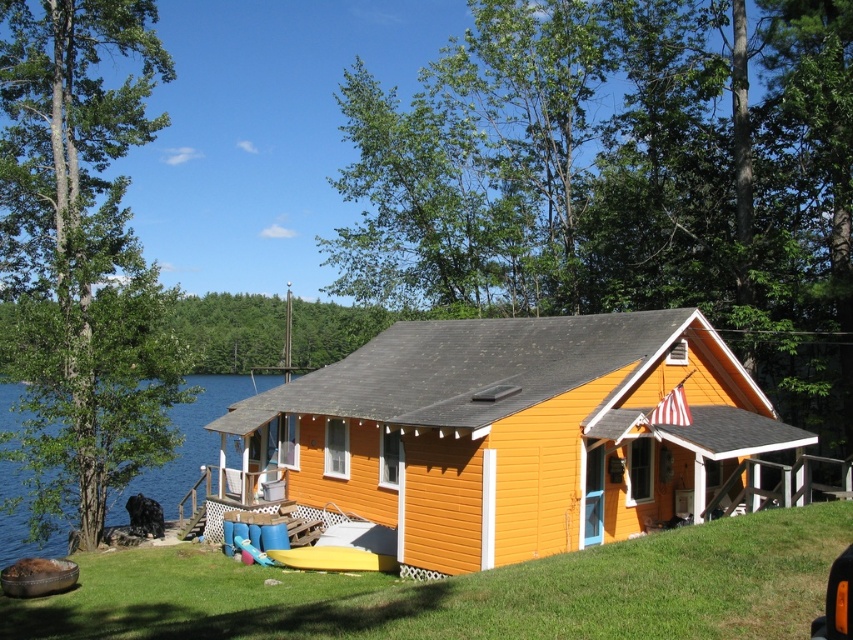
Can you confirm if orange wood cabin at center is positioned below blue water at left?

Incorrect, orange wood cabin at center is not positioned below blue water at left.

Between orange wood cabin at center and blue water at left, which one has less height?

orange wood cabin at center

Between point (252, 477) and point (212, 448), which one is positioned in front?

Point (252, 477) is in front.

This screenshot has height=640, width=853. I want to click on orange wood cabin at center, so click(x=508, y=433).